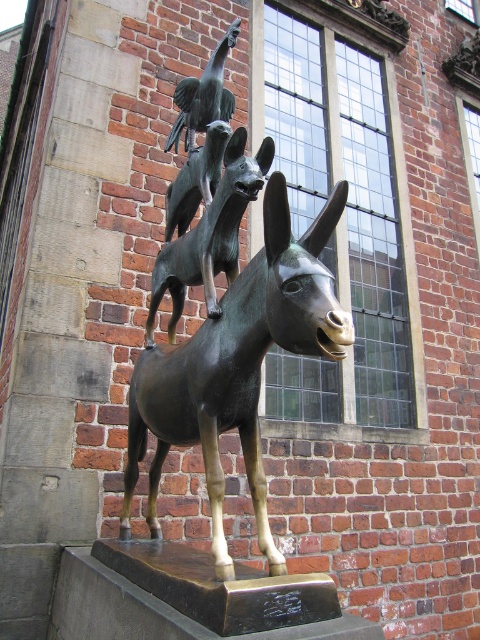
Question: Which of the following is the closest to the observer?

Choices:
 (A) (252, 458)
 (B) (184, 260)
 (C) (175, 198)
 (D) (216, 77)

Answer: (A)

Question: Considering the relative positions of bronze horse at center and bronze/statue at center in the image provided, where is bronze horse at center located with respect to bronze/statue at center?

Choices:
 (A) below
 (B) above

Answer: (A)

Question: Is bronze horse at center closer to the viewer compared to bronze/statue at center?

Choices:
 (A) yes
 (B) no

Answer: (A)

Question: Does bronze/statue at center come behind bronze bird at center?

Choices:
 (A) no
 (B) yes

Answer: (A)

Question: Which point appears farthest from the camera in this image?

Choices:
 (A) (190, 166)
 (B) (343, 333)
 (C) (165, 148)
 (D) (205, 259)

Answer: (C)

Question: Among these points, which one is farthest from the camera?

Choices:
 (A) (216, 256)
 (B) (216, 109)
 (C) (330, 294)

Answer: (B)